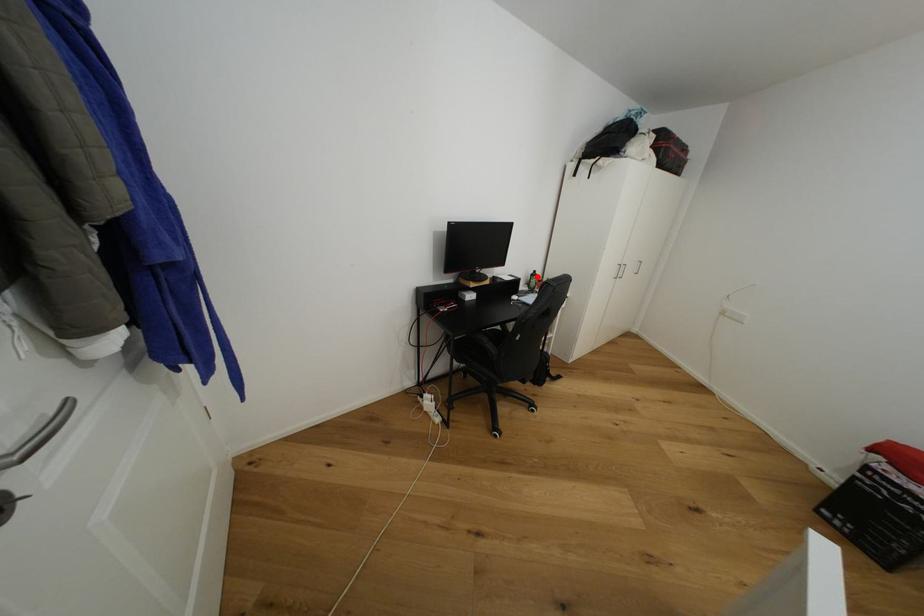
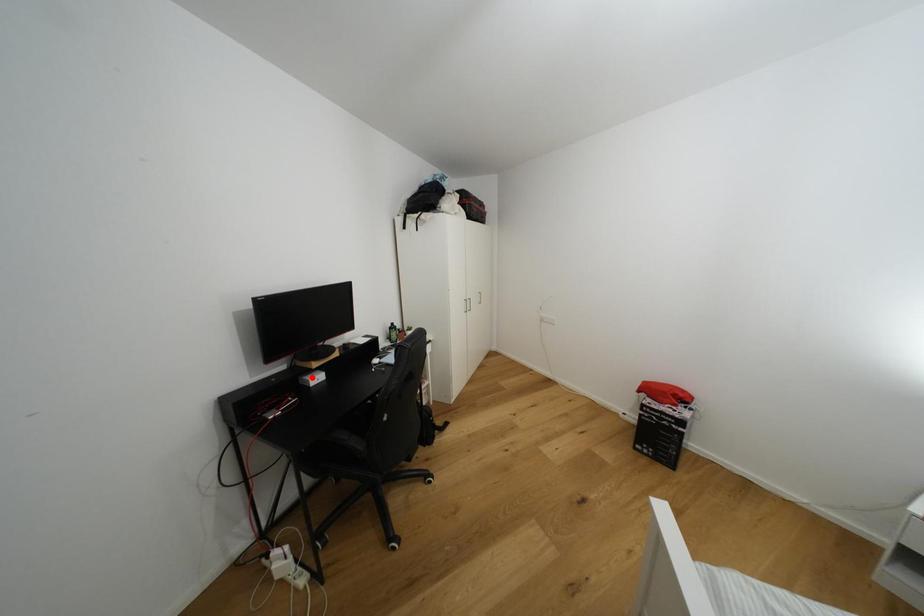
I am providing you with two images of the same scene from different viewpoints. A red point is marked on the first image and another point is marked on the second image. Are the points marked in image1 and image2 representing the same 3D position?

No